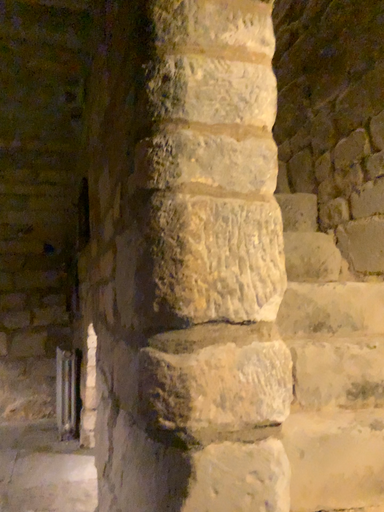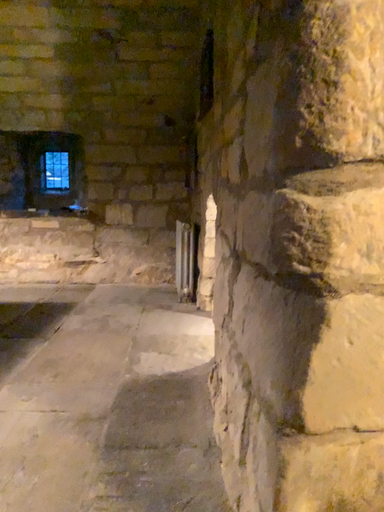
Question: Which way did the camera rotate in the video?

Choices:
 (A) rotated upward
 (B) rotated downward

Answer: (B)